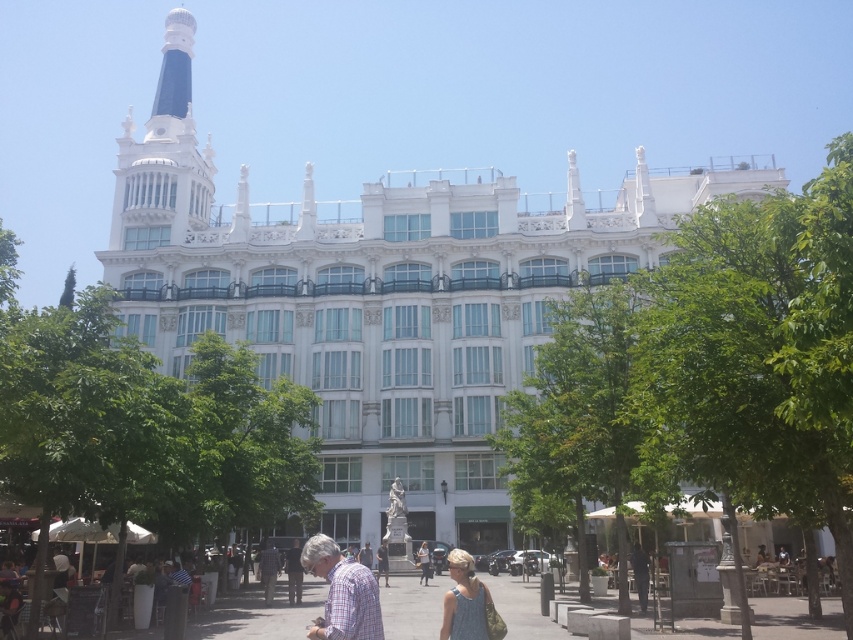
Question: Can you confirm if white glossy building at center is positioned to the right of light blue denim dress at lower center?

Choices:
 (A) no
 (B) yes

Answer: (A)

Question: Which object appears farthest from the camera in this image?

Choices:
 (A) checkered fabric shirt at center
 (B) white glossy building at center
 (C) light gray fabric jacket at center
 (D) light blue denim dress at lower center

Answer: (B)

Question: Can you confirm if light blue denim dress at lower center is positioned to the right of dark blue shirt at center?

Choices:
 (A) no
 (B) yes

Answer: (B)

Question: Which object appears farthest from the camera in this image?

Choices:
 (A) white glossy building at center
 (B) light blue denim dress at lower center

Answer: (A)

Question: Is white glossy building at center to the left of light blue denim dress at lower center from the viewer's perspective?

Choices:
 (A) no
 (B) yes

Answer: (B)

Question: Among these points, which one is nearest to the camera?

Choices:
 (A) (366, 561)
 (B) (263, 596)
 (C) (442, 618)
 (D) (340, 577)

Answer: (D)